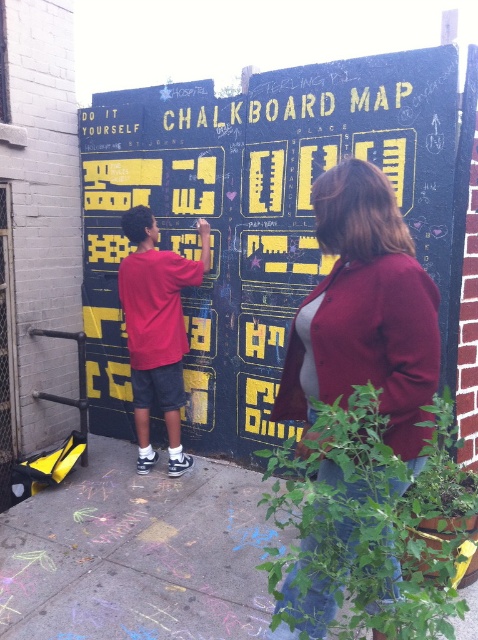
You are a painter standing in front of the black chalkboard map at center and the matte red shirt at left. You need to paint a large mural that covers both objects. Which object should you paint first to avoid smudging the other one?

The black chalkboard map at center should be painted first because it is positioned over the matte red shirt at left, meaning the shirt is underneath. Painting the lower object first allows the upper object to be painted without smudging the lower one.

You are a delivery person with a 30 inch wide package. You need to walk from the matte red shirt at left to the concrete sidewalk at lower center. Is there enough space to carry the package without tilting it sideways?

The distance between the matte red shirt at left and the concrete sidewalk at lower center is 32.20 inches, which is wider than the 30 inch package. Therefore, there is enough space to carry the package without tilting it sideways.